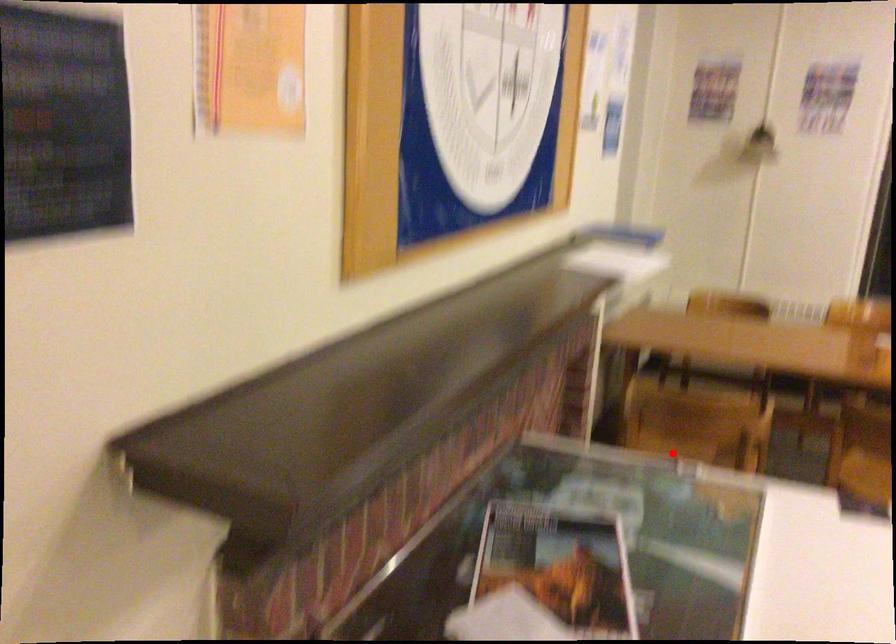
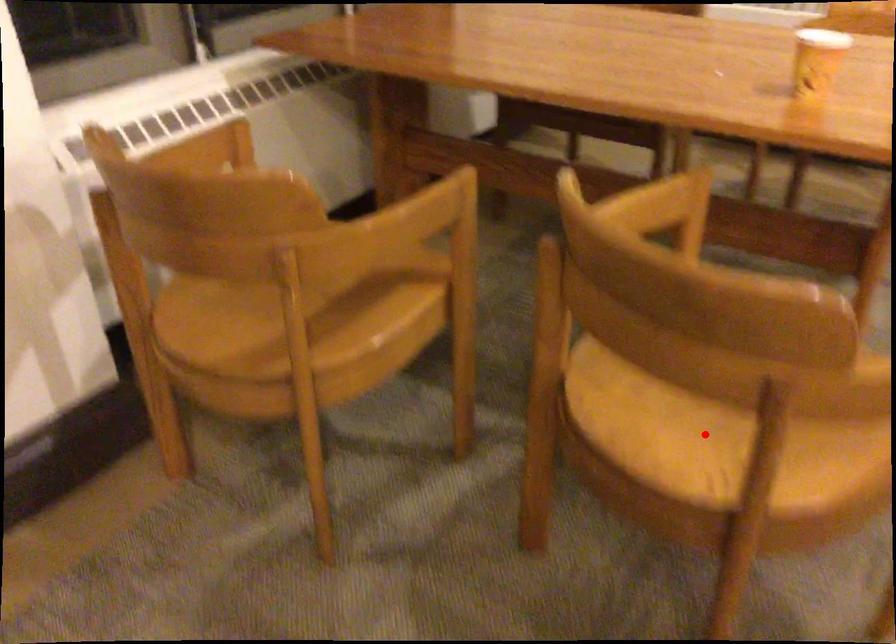
I am providing you with two images of the same scene from different viewpoints. A red point is marked on the first image and another point is marked on the second image. Are the points marked in image1 and image2 representing the same 3D position?

No